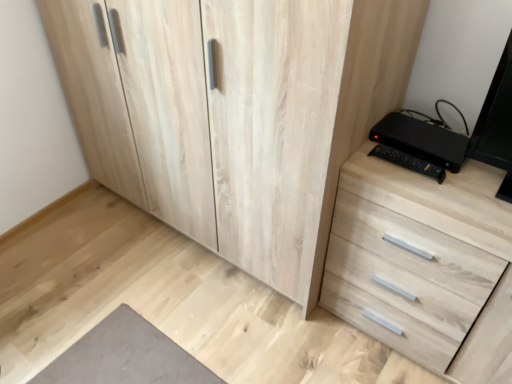
Question: From the image's perspective, is natural wood cupboard at center located above black plastic at right?

Choices:
 (A) no
 (B) yes

Answer: (B)

Question: Does natural wood cupboard at center come behind black plastic at right?

Choices:
 (A) no
 (B) yes

Answer: (A)

Question: Can you confirm if natural wood cupboard at center is smaller than black plastic at right?

Choices:
 (A) no
 (B) yes

Answer: (A)

Question: Is black plastic at right at the back of natural wood cupboard at center?

Choices:
 (A) yes
 (B) no

Answer: (B)

Question: Is natural wood cupboard at center bigger than black plastic at right?

Choices:
 (A) yes
 (B) no

Answer: (A)

Question: Is natural wood cupboard at center spatially inside black plastic at right, or outside of it?

Choices:
 (A) inside
 (B) outside

Answer: (B)

Question: From a real-world perspective, is natural wood cupboard at center above or below black plastic at right?

Choices:
 (A) above
 (B) below

Answer: (B)

Question: Looking at the image, does natural wood cupboard at center seem bigger or smaller compared to black plastic at right?

Choices:
 (A) big
 (B) small

Answer: (A)

Question: Does point (146, 77) appear closer or farther from the camera than point (442, 144)?

Choices:
 (A) closer
 (B) farther

Answer: (B)

Question: Based on their sizes in the image, would you say black plastic at right is bigger or smaller than natural wood cupboard at center?

Choices:
 (A) small
 (B) big

Answer: (A)

Question: Visually, is black plastic at right positioned to the left or to the right of natural wood cupboard at center?

Choices:
 (A) left
 (B) right

Answer: (B)

Question: Considering the positions of point (463, 137) and point (330, 130), is point (463, 137) closer or farther from the camera than point (330, 130)?

Choices:
 (A) closer
 (B) farther

Answer: (B)

Question: From the image's perspective, is black plastic at right above or below natural wood cupboard at center?

Choices:
 (A) above
 (B) below

Answer: (B)

Question: From a real-world perspective, is natural wood cupboard at center physically located above or below light wood chest of drawers at right?

Choices:
 (A) below
 (B) above

Answer: (B)

Question: Is natural wood cupboard at center in front of or behind light wood chest of drawers at right in the image?

Choices:
 (A) behind
 (B) front

Answer: (B)